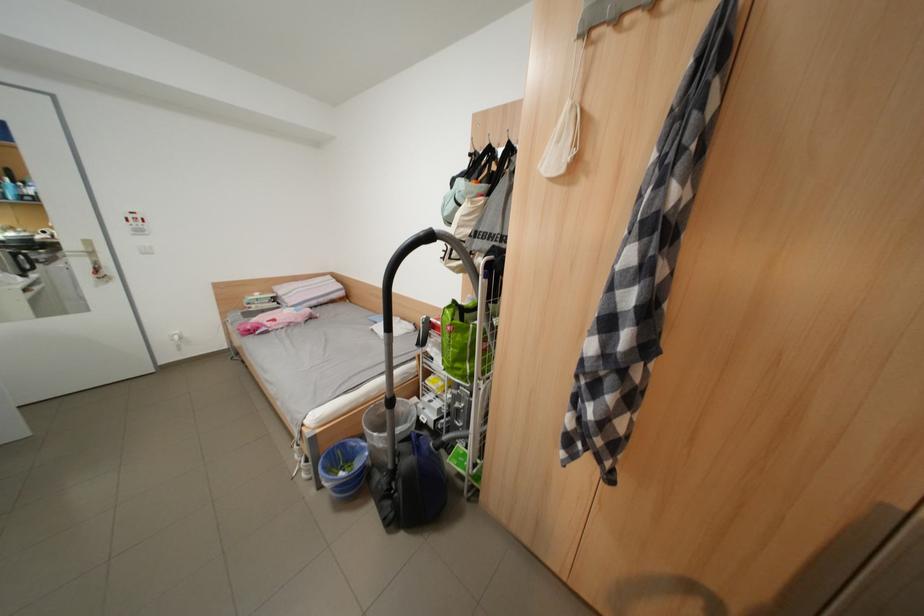
What do you see at coordinates (275, 320) in the screenshot? I see `a pink stuffed toy` at bounding box center [275, 320].